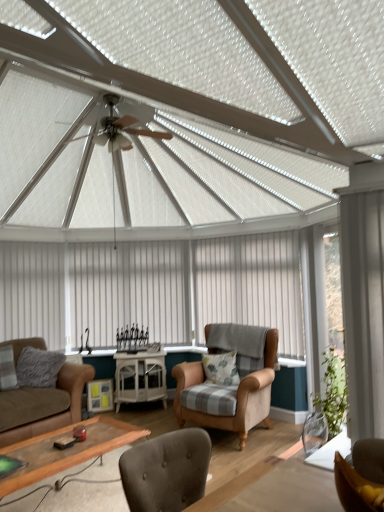
Question: Should I look upward or downward to see white glossy cabinet at center?

Choices:
 (A) up
 (B) down

Answer: (B)

Question: From the image's perspective, is gray fluffy pillow at lower left, placed as the second pillow when sorted from right to left, beneath white glossy cabinet at center?

Choices:
 (A) no
 (B) yes

Answer: (A)

Question: Does gray fluffy pillow at lower left, which is the 1th pillow from left to right, appear on the left side of white glossy cabinet at center?

Choices:
 (A) no
 (B) yes

Answer: (B)

Question: Is gray fluffy pillow at lower left, placed as the second pillow when sorted from right to left, closer to the viewer compared to white glossy cabinet at center?

Choices:
 (A) no
 (B) yes

Answer: (B)

Question: Is the surface of gray fluffy pillow at lower left, which is the 1th pillow from left to right, in direct contact with white glossy cabinet at center?

Choices:
 (A) no
 (B) yes

Answer: (A)

Question: Considering the relative sizes of gray fluffy pillow at lower left, placed as the second pillow when sorted from right to left, and white glossy cabinet at center in the image provided, is gray fluffy pillow at lower left, placed as the second pillow when sorted from right to left, taller than white glossy cabinet at center?

Choices:
 (A) no
 (B) yes

Answer: (A)

Question: Is gray fluffy pillow at lower left, placed as the second pillow when sorted from right to left, surrounding white glossy cabinet at center?

Choices:
 (A) no
 (B) yes

Answer: (A)

Question: Is wooden glass coffee table at lower center in contact with brown fabric chair at lower right, the first chair in the top-to-bottom sequence?

Choices:
 (A) yes
 (B) no

Answer: (B)

Question: Considering the relative positions of wooden glass coffee table at lower center and brown fabric chair at lower right, which appears as the 2th chair when viewed from the back, in the image provided, is wooden glass coffee table at lower center to the left of brown fabric chair at lower right, which appears as the 2th chair when viewed from the back, from the viewer's perspective?

Choices:
 (A) yes
 (B) no

Answer: (A)

Question: From a real-world perspective, is wooden glass coffee table at lower center positioned under brown fabric chair at lower right, which appears as the 2th chair when viewed from the back, based on gravity?

Choices:
 (A) yes
 (B) no

Answer: (A)

Question: Does wooden glass coffee table at lower center have a smaller size compared to brown fabric chair at lower right, positioned as the 1th chair in front-to-back order?

Choices:
 (A) no
 (B) yes

Answer: (A)

Question: Does wooden glass coffee table at lower center lie behind brown fabric chair at lower right, which is the 2th chair from bottom to top?

Choices:
 (A) yes
 (B) no

Answer: (A)

Question: Is wooden glass coffee table at lower center oriented towards brown fabric chair at lower right, which is the 2th chair from bottom to top?

Choices:
 (A) yes
 (B) no

Answer: (B)

Question: From a real-world perspective, is white fabric curtain at left, the first curtain from the left, over white sheer curtain at right, which is the 4th curtain from back to front?

Choices:
 (A) no
 (B) yes

Answer: (A)